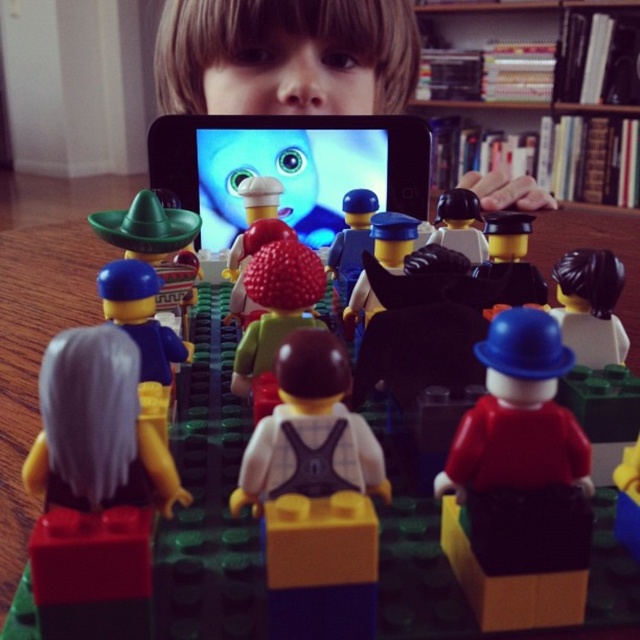
Between green plastic sombrero at left and smooth black hat at center, which one is positioned higher?

Positioned higher is green plastic sombrero at left.

The image size is (640, 640). Describe the element at coordinates (156, 244) in the screenshot. I see `green plastic sombrero at left` at that location.

This screenshot has width=640, height=640. Find the location of `green plastic sombrero at left`. green plastic sombrero at left is located at coordinates (156, 244).

Which of these two, matte black phone at upper center or wooden bookshelf at upper center, stands taller?

wooden bookshelf at upper center

Is point (356, 49) positioned after point (467, 36)?

No, it is in front of (467, 36).

Locate an element on the screen. The width and height of the screenshot is (640, 640). matte black phone at upper center is located at coordinates (285, 56).

Who is more distant from viewer, (180, 262) or (150, 276)?

Point (180, 262)

Where is `green plastic sombrero at left`? This screenshot has width=640, height=640. green plastic sombrero at left is located at coordinates (156, 244).

Locate an element on the screen. This screenshot has height=640, width=640. green plastic sombrero at left is located at coordinates (156, 244).